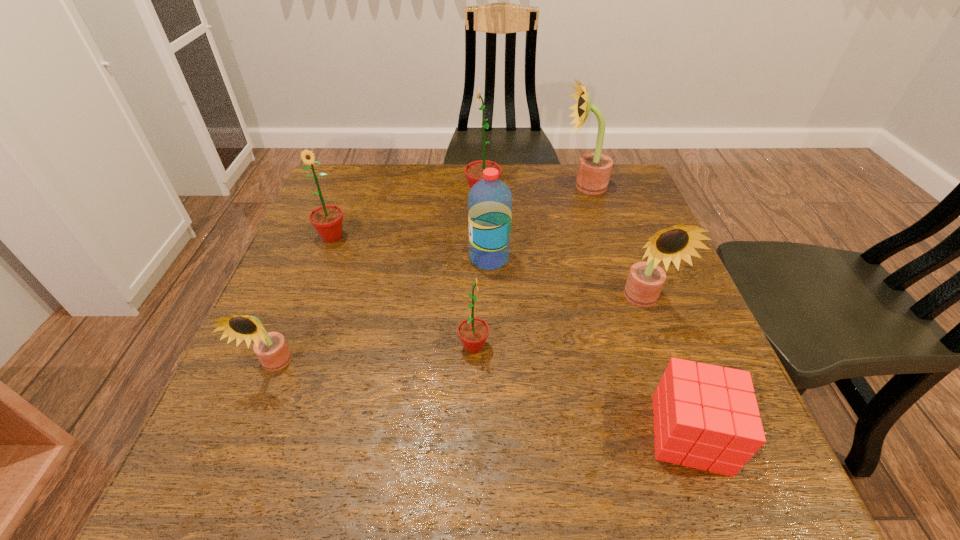
Locate an element on the screen. The width and height of the screenshot is (960, 540). the nearest object is located at coordinates (705, 417).

Where is `red cube`? This screenshot has width=960, height=540. red cube is located at coordinates (705, 417).

Locate an element on the screen. Image resolution: width=960 pixels, height=540 pixels. vacant space located on the face of the biggest yellow sunflower is located at coordinates (469, 186).

Locate an element on the screen. vacant space located 0.130m on the face of the biggest yellow sunflower is located at coordinates (516, 186).

The height and width of the screenshot is (540, 960). What are the coordinates of `free spot located 0.080m on the face of the biggest yellow sunflower` in the screenshot? It's located at (534, 186).

Locate an element on the screen. vacant area situated on the face of the biggest green sunflower is located at coordinates (429, 197).

Locate an element on the screen. The height and width of the screenshot is (540, 960). vacant region located 0.140m on the face of the biggest green sunflower is located at coordinates (415, 197).

The width and height of the screenshot is (960, 540). Find the location of `free space located on the face of the biggest green sunflower`. free space located on the face of the biggest green sunflower is located at coordinates (396, 197).

The image size is (960, 540). I want to click on vacant space positioned 0.230m on the face of the second biggest green sunflower, so click(300, 320).

Locate an element on the screen. The width and height of the screenshot is (960, 540). free region located 0.310m on the face of the second biggest yellow sunflower is located at coordinates (x=706, y=474).